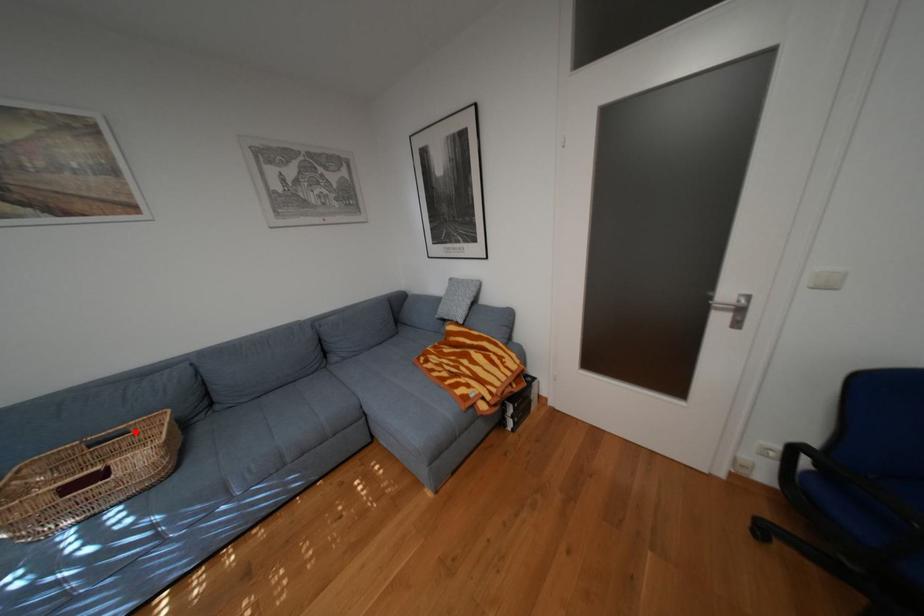
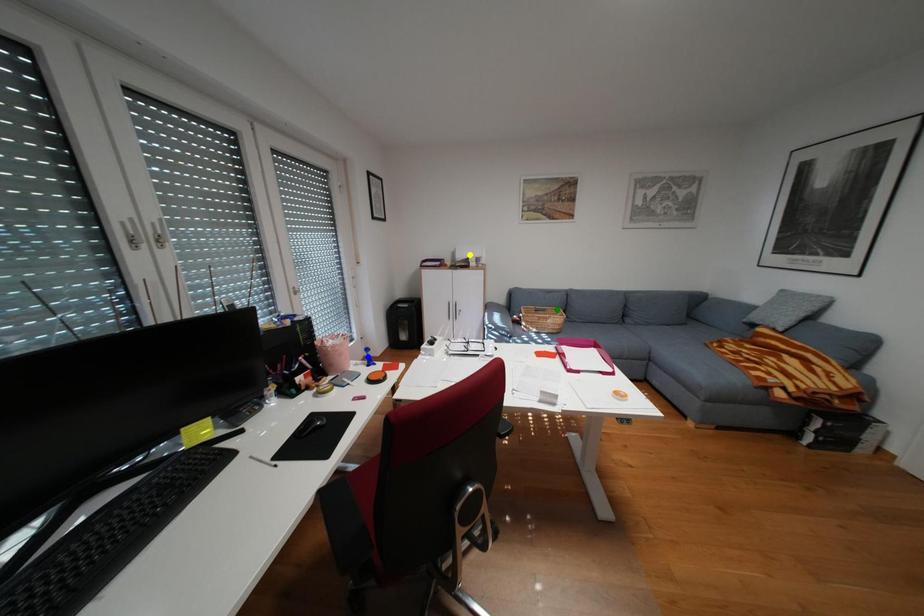
Question: I am providing you with two images of the same scene from different viewpoints. A red point is marked on the first image. You are given multiple points on the second image. Can you choose the point in image 2 that corresponds to the point in image 1?

Choices:
 (A) blue point
 (B) green point
 (C) yellow point

Answer: (B)